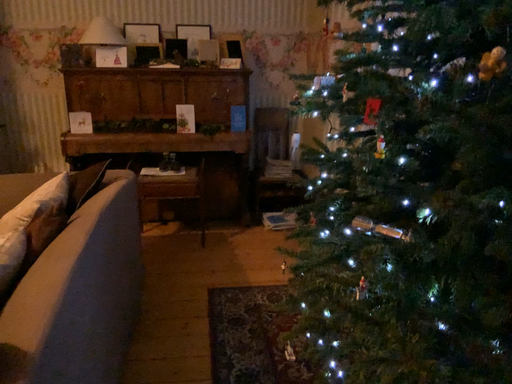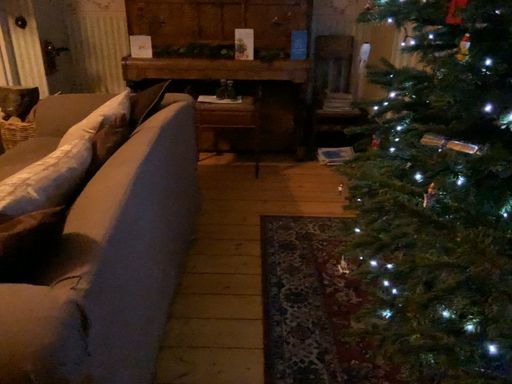
Question: Which way did the camera rotate in the video?

Choices:
 (A) rotated right
 (B) rotated left

Answer: (B)